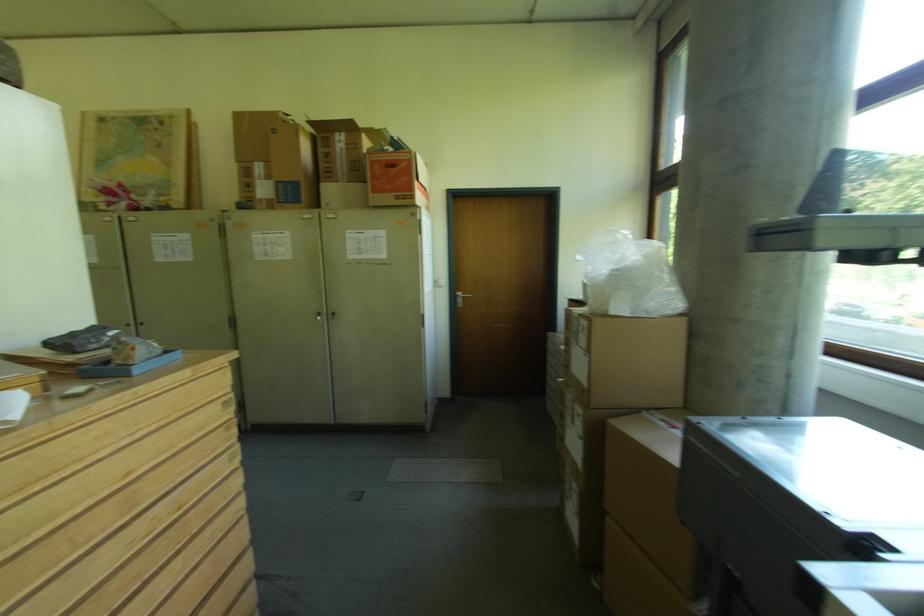
The location [396,179] corresponds to which object?

It refers to a red and white box.